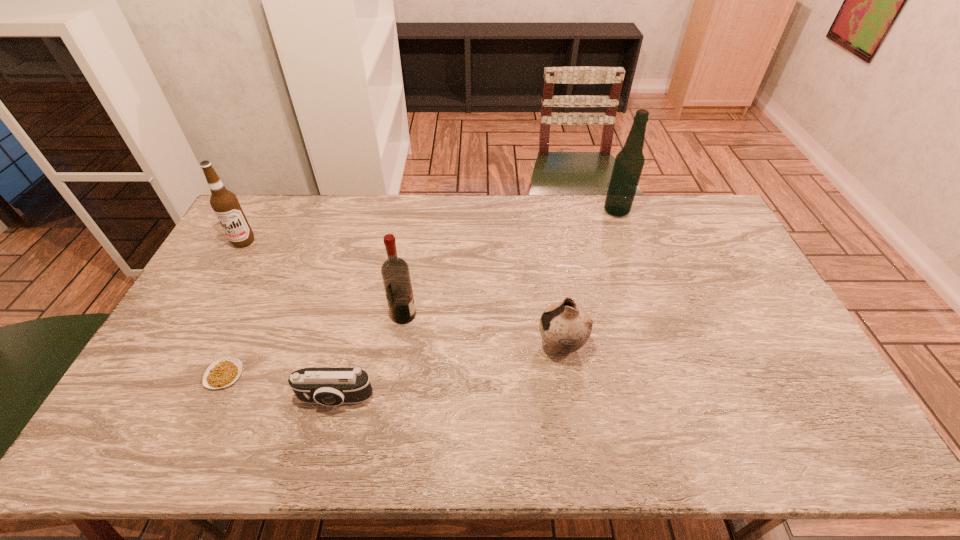
Locate an element on the screen. legume present at the left edge is located at coordinates (223, 372).

Identify the location of object positioned at the far left corner. The width and height of the screenshot is (960, 540). (225, 204).

The width and height of the screenshot is (960, 540). In the image, there is a desktop. In order to click on free region at the far edge in this screenshot , I will do `click(298, 219)`.

In the image, there is a desktop. In order to click on vacant region at the near edge in this screenshot , I will do `click(684, 444)`.

Locate an element on the screen. vacant space at the left edge of the desktop is located at coordinates (208, 340).

I want to click on blank space at the right edge, so click(728, 287).

The height and width of the screenshot is (540, 960). I want to click on vacant space at the far left corner of the desktop, so click(276, 225).

Where is `vacant space at the near left corner of the desktop`? The width and height of the screenshot is (960, 540). vacant space at the near left corner of the desktop is located at coordinates (124, 439).

Find the location of `vacant space at the far right corner of the desktop`. vacant space at the far right corner of the desktop is located at coordinates (705, 214).

Where is `unoccupied area between the second nearest alcohol and the second alcohol from left to right`? The image size is (960, 540). unoccupied area between the second nearest alcohol and the second alcohol from left to right is located at coordinates (324, 278).